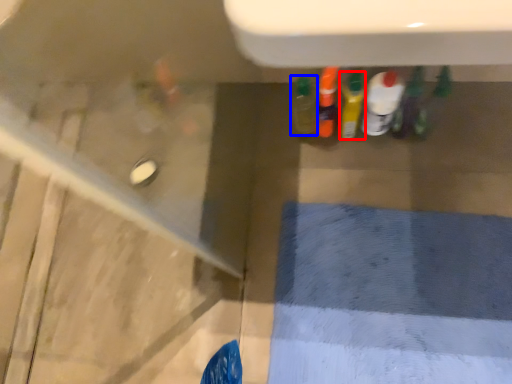
Question: Which object is further to the camera taking this photo, bottle (highlighted by a red box) or bottle (highlighted by a blue box)?

Choices:
 (A) bottle
 (B) bottle

Answer: (B)